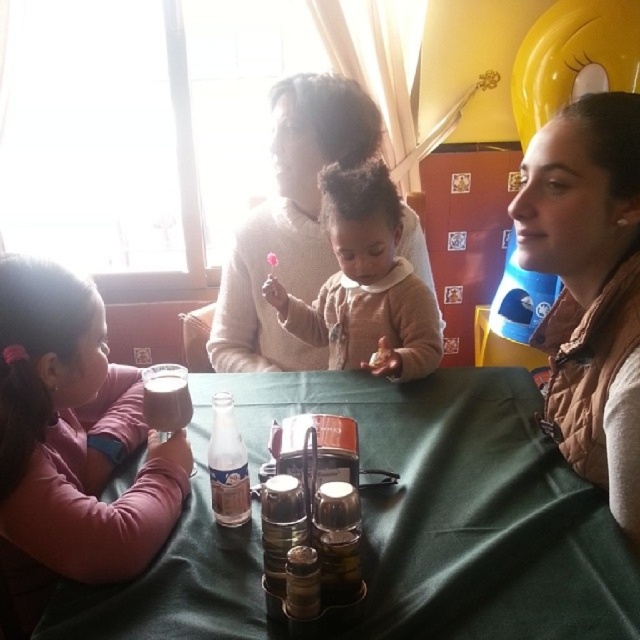
Which of these two, pink fabric shirt at left or soft beige sweater at center, stands taller?

Standing taller between the two is soft beige sweater at center.

Who is shorter, pink fabric shirt at left or soft beige sweater at center?

With less height is pink fabric shirt at left.

Is point (1, 298) closer to camera compared to point (428, 339)?

Yes.

You are a GUI agent. You are given a task and a screenshot of the screen. Output one action in this format:
    pyautogui.click(x=<x>, y=<y>)
    Task: Click on the pink fabric shirt at left
    Image resolution: width=640 pixels, height=640 pixels.
    Given the screenshot: What is the action you would take?
    pyautogui.click(x=76, y=433)

Does brown quilted vest at right have a smaller size compared to soft beige sweater at center?

Correct, brown quilted vest at right occupies less space than soft beige sweater at center.

Who is higher up, brown quilted vest at right or soft beige sweater at center?

soft beige sweater at center

Locate an element on the screen. Image resolution: width=640 pixels, height=640 pixels. brown quilted vest at right is located at coordinates (589, 285).

The height and width of the screenshot is (640, 640). I want to click on brown quilted vest at right, so click(589, 285).

Can you confirm if green fabric table at center is positioned above pink fabric shirt at left?

Incorrect, green fabric table at center is not positioned above pink fabric shirt at left.

Who is positioned more to the left, green fabric table at center or pink fabric shirt at left?

pink fabric shirt at left

The width and height of the screenshot is (640, 640). Describe the element at coordinates (396, 524) in the screenshot. I see `green fabric table at center` at that location.

This screenshot has width=640, height=640. I want to click on green fabric table at center, so click(x=396, y=524).